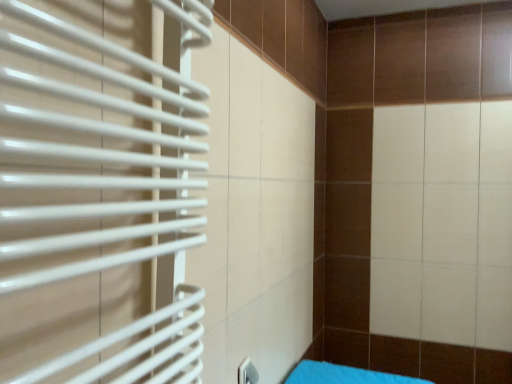
Question: From their relative heights in the image, would you say white matte radiator at left is taller or shorter than blue fabric bed at lower right?

Choices:
 (A) tall
 (B) short

Answer: (A)

Question: Is white matte radiator at left inside the boundaries of blue fabric bed at lower right, or outside?

Choices:
 (A) inside
 (B) outside

Answer: (B)

Question: Is white matte radiator at left to the left or to the right of blue fabric bed at lower right in the image?

Choices:
 (A) right
 (B) left

Answer: (B)

Question: In the image, is blue fabric bed at lower right on the left side or the right side of white matte radiator at left?

Choices:
 (A) left
 (B) right

Answer: (B)

Question: Choose the correct answer: Is blue fabric bed at lower right inside white matte radiator at left or outside it?

Choices:
 (A) inside
 (B) outside

Answer: (B)

Question: From the image's perspective, is blue fabric bed at lower right positioned above or below white matte radiator at left?

Choices:
 (A) above
 (B) below

Answer: (B)

Question: From a real-world perspective, is blue fabric bed at lower right above or below white matte radiator at left?

Choices:
 (A) below
 (B) above

Answer: (A)